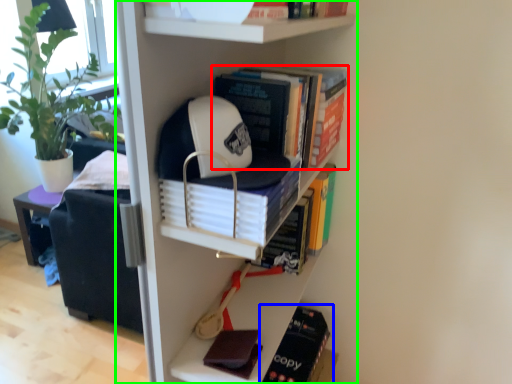
Question: Based on their relative distances, which object is nearer to book (highlighted by a red box)? Choose from book (highlighted by a blue box) and bookcase (highlighted by a green box).

Choices:
 (A) book
 (B) bookcase

Answer: (B)